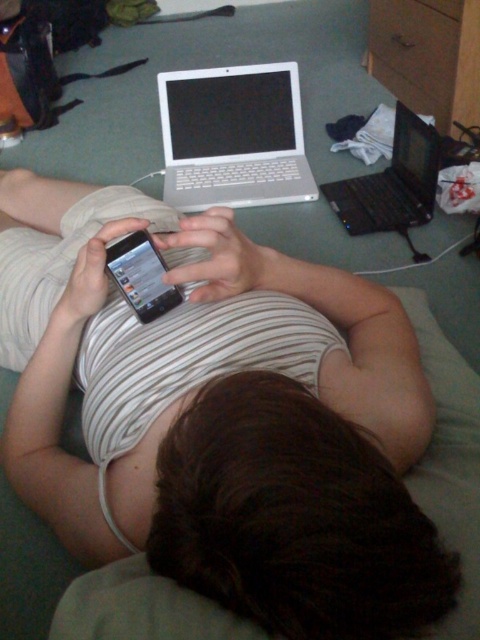
Is silver metallic laptop at upper center above satin black phone at center?

Yes, silver metallic laptop at upper center is above satin black phone at center.

Which is in front, point (189, 141) or point (109, 259)?

Point (109, 259) is in front.

At what (x,y) coordinates should I click in order to perform the action: click on silver metallic laptop at upper center. Please return your answer as a coordinate pair (x, y). Looking at the image, I should click on (233, 138).

Does wooden dresser at upper center have a lesser width compared to black plastic laptop at upper right?

Yes.

Based on the photo, between wooden dresser at upper center and black plastic laptop at upper right, which one has less height?

black plastic laptop at upper right

Between point (397, 97) and point (332, 192), which one is positioned in front?

Point (332, 192) is in front.

This screenshot has height=640, width=480. In order to click on wooden dresser at upper center in this screenshot , I will do `click(428, 54)`.

Does matte black phone at upper center have a greater height compared to black plastic laptop at upper right?

Correct, matte black phone at upper center is much taller as black plastic laptop at upper right.

Between matte black phone at upper center and black plastic laptop at upper right, which one is positioned lower?

Positioned lower is matte black phone at upper center.

You are a GUI agent. You are given a task and a screenshot of the screen. Output one action in this format:
    pyautogui.click(x=<x>, y=<y>)
    Task: Click on the matte black phone at upper center
    
    Given the screenshot: What is the action you would take?
    pyautogui.click(x=222, y=417)

Identify the location of matte black phone at upper center. (222, 417).